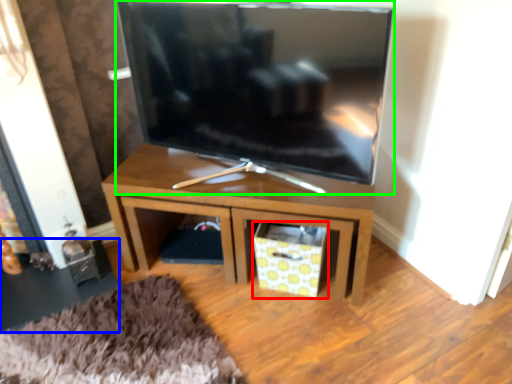
Question: Which is farther away from drawer (highlighted by a red box)? side table (highlighted by a blue box) or television (highlighted by a green box)?

Choices:
 (A) side table
 (B) television

Answer: (A)